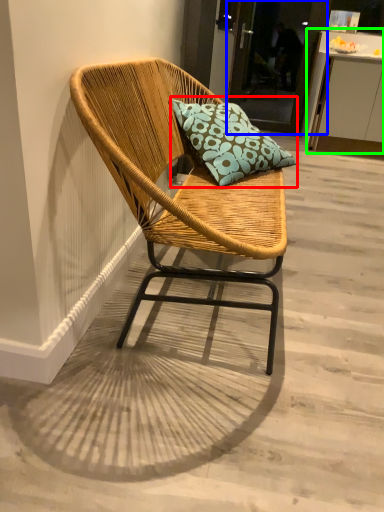
Question: Which is nearer to the pillow (highlighted by a red box)? glass door (highlighted by a blue box) or table (highlighted by a green box).

Choices:
 (A) glass door
 (B) table

Answer: (B)